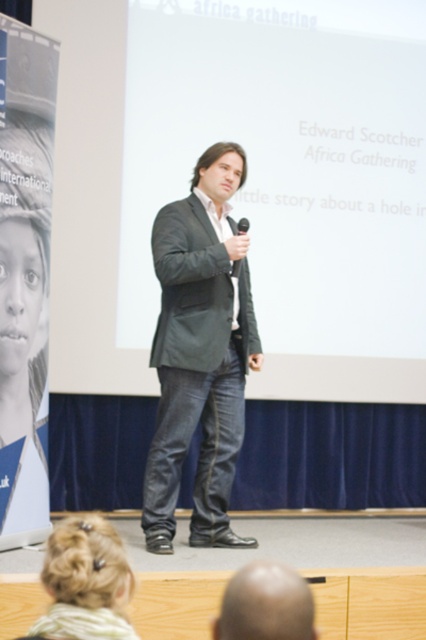
Question: Can you confirm if dark gray suit at center is positioned above blonde hair bun at lower left?

Choices:
 (A) yes
 (B) no

Answer: (A)

Question: Considering the real-world distances, which object is farthest from the white matte projection screen at center?

Choices:
 (A) bald head at lower center
 (B) dark gray suit at center
 (C) black matte microphone at center

Answer: (A)

Question: Can you confirm if white matte projection screen at center is smaller than blonde hair bun at lower left?

Choices:
 (A) yes
 (B) no

Answer: (B)

Question: Which point appears farthest from the camera in this image?

Choices:
 (A) pos(287,216)
 (B) pos(60,627)
 (C) pos(276,609)
 (D) pos(241,260)

Answer: (A)

Question: Considering the relative positions of white matte projection screen at center and bald head at lower center in the image provided, where is white matte projection screen at center located with respect to bald head at lower center?

Choices:
 (A) left
 (B) right

Answer: (B)

Question: Considering the real-world distances, which object is farthest from the white matte projection screen at center?

Choices:
 (A) bald head at lower center
 (B) dark gray suit at center
 (C) black matte microphone at center

Answer: (A)